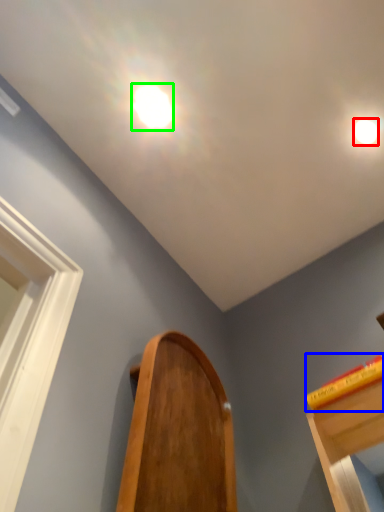
Question: Estimate the real-world distances between objects in this image. Which object is farther from droplight (highlighted by a red box), book (highlighted by a blue box) or droplight (highlighted by a green box)?

Choices:
 (A) book
 (B) droplight

Answer: (A)